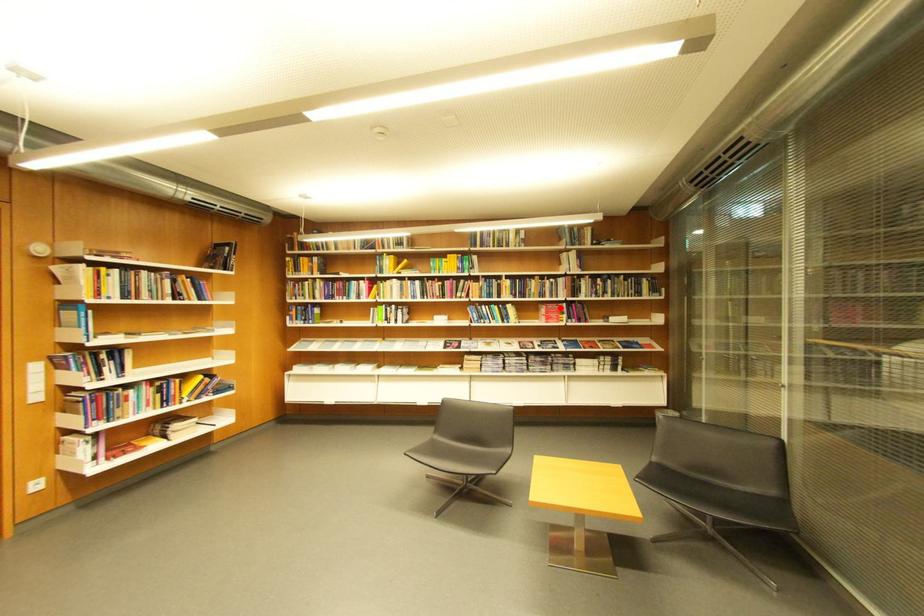
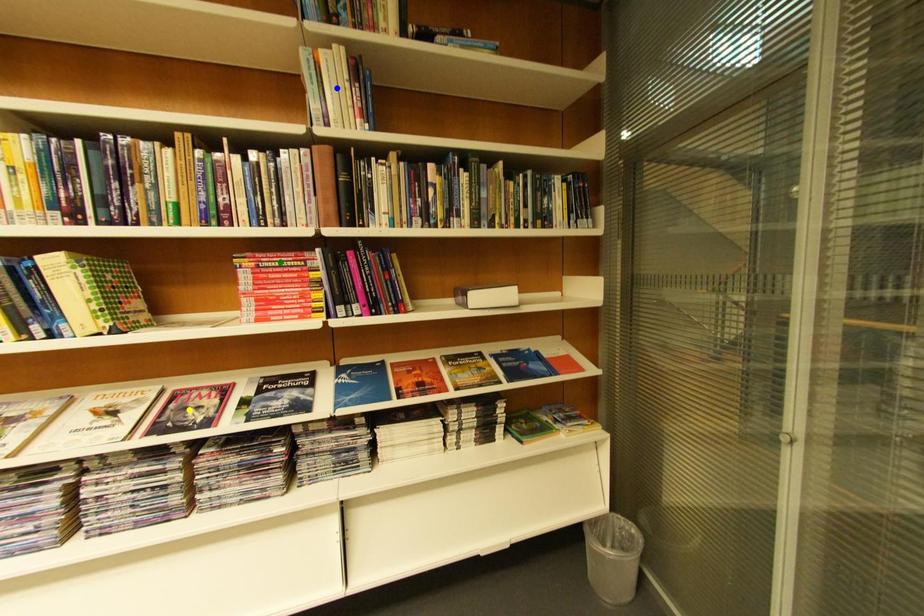
Question: I am providing you with two images of the same scene from different viewpoints. A red point is marked on the first image. You are given multiple points on the second image. Can you choose the point in image 2 that corresponds to the point in image 1?

Choices:
 (A) blue point
 (B) yellow point
 (C) green point

Answer: (C)